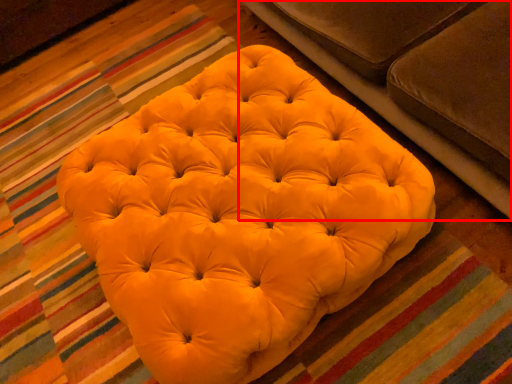
Question: From the image's perspective, where is studio couch (annotated by the red box) located relative to furniture?

Choices:
 (A) above
 (B) below

Answer: (A)